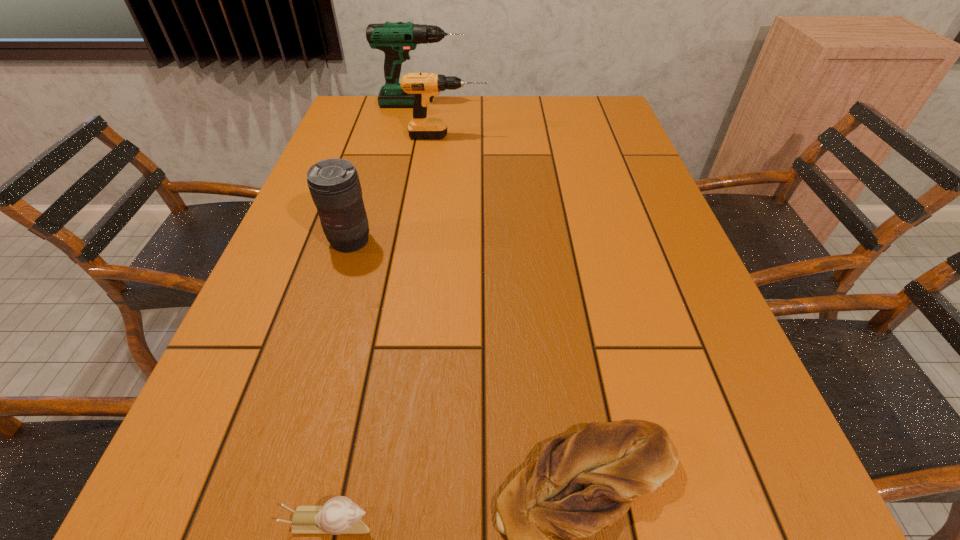
At what (x,y) coordinates should I click in order to perform the action: click on free space in the image that satisfies the following two spatial constraints: 1. at the tip of the shorter drill; 2. on the side of the third farthest object where the control switches are located. Please return your answer as a coordinate pair (x, y). The height and width of the screenshot is (540, 960). Looking at the image, I should click on (436, 241).

At what (x,y) coordinates should I click in order to perform the action: click on vacant space that satisfies the following two spatial constraints: 1. on the handle side of the farthest object; 2. on the side of the third nearest object where the control switches are located. Please return your answer as a coordinate pair (x, y). The image size is (960, 540). Looking at the image, I should click on (395, 241).